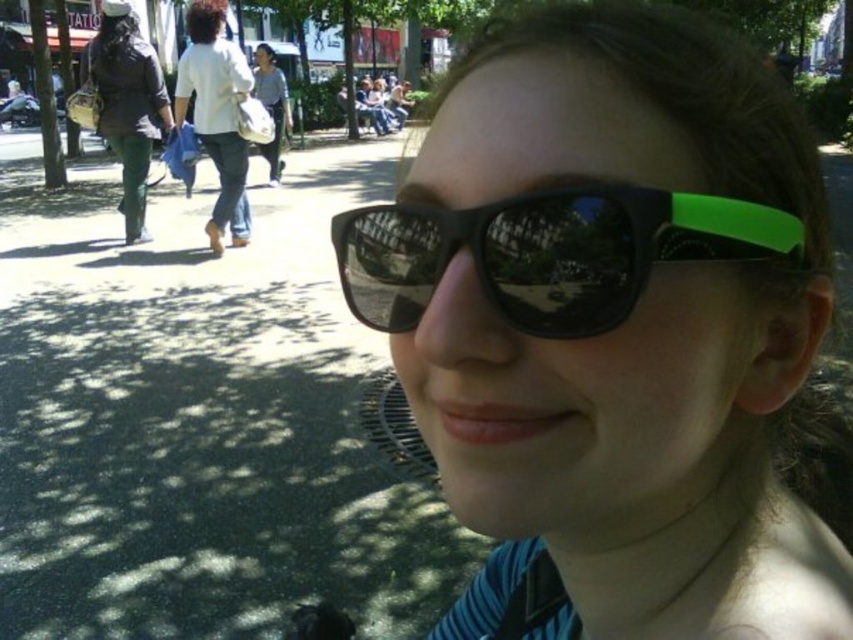
You are a fashion designer observing the scene. You need to determine which item is narrower between the black matte sunglasses at center and the white cotton shirt at upper left. Which one is it?

The black matte sunglasses at center has a lesser width compared to the white cotton shirt at upper left, so the black matte sunglasses at center is narrower.